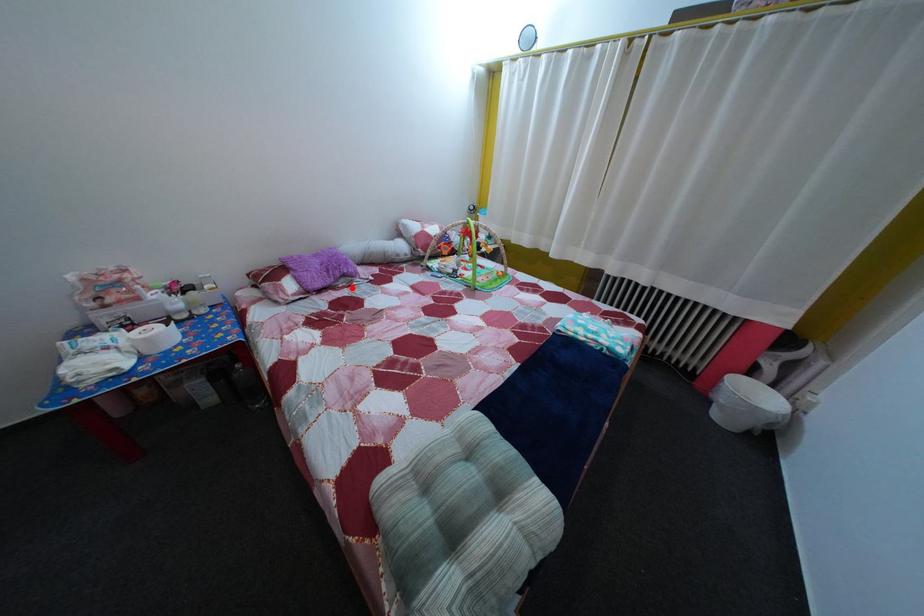
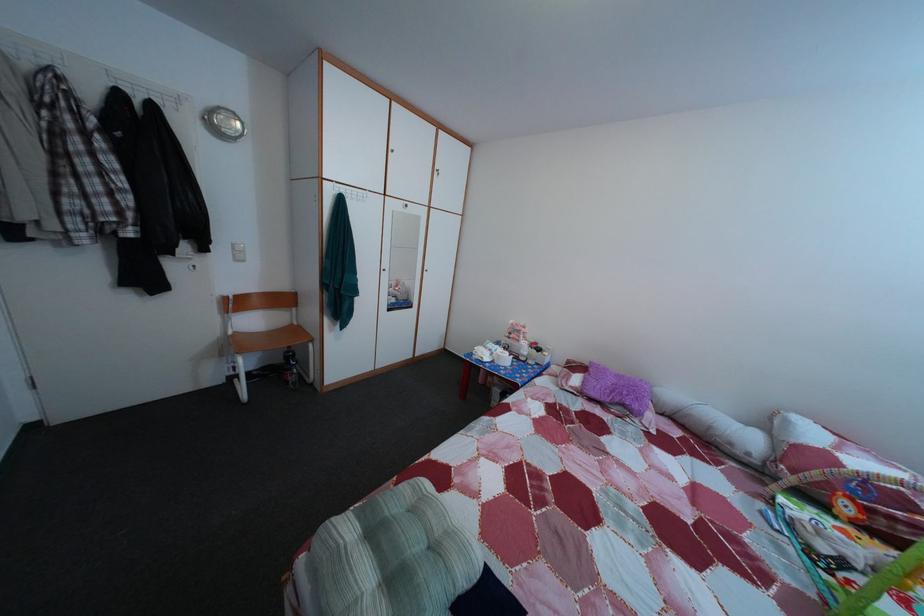
Where in the second image is the point corresponding to the highlighted location from the first image?

(628, 416)